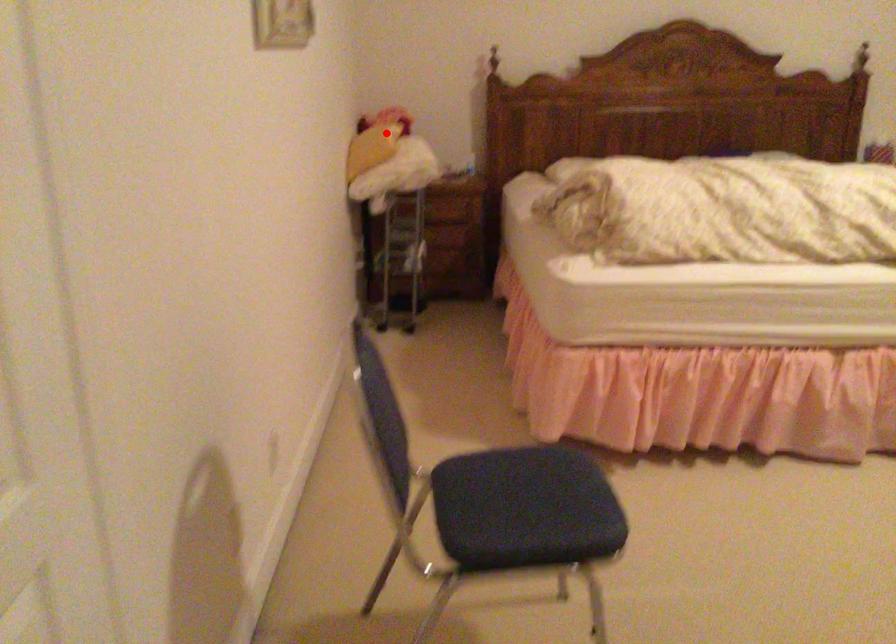
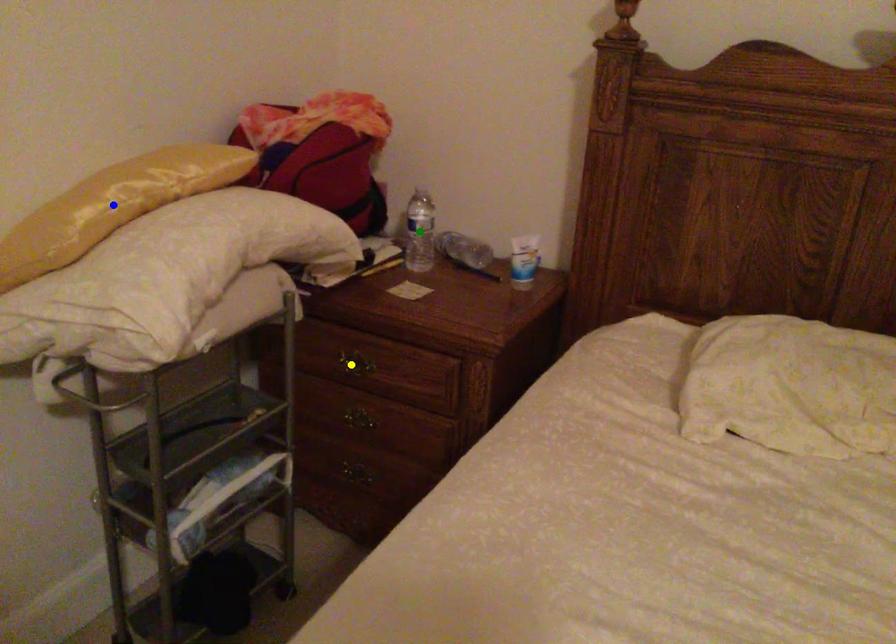
Question: I am providing you with two images of the same scene from different viewpoints. A red point is marked on the first image. You are given multiple points on the second image. In image 2, which mark is for the same physical point as the one in image 1?

Choices:
 (A) yellow point
 (B) green point
 (C) blue point

Answer: (C)